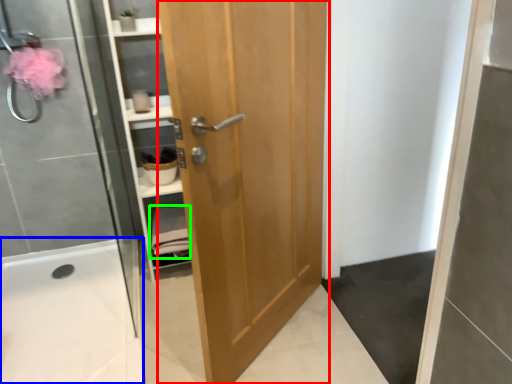
Question: Which object is the closest to the door (highlighted by a red box)? Choose among these: bath (highlighted by a blue box) or material (highlighted by a green box).

Choices:
 (A) bath
 (B) material

Answer: (B)